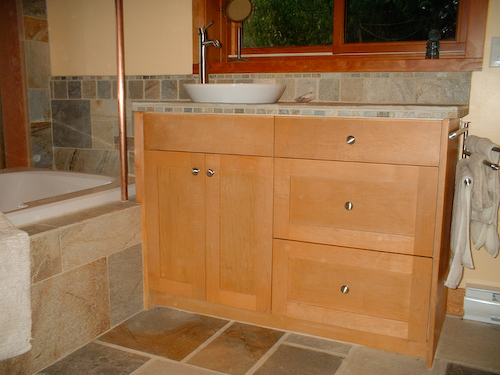
Identify the location of bathtub. This screenshot has height=375, width=500. (27, 189).